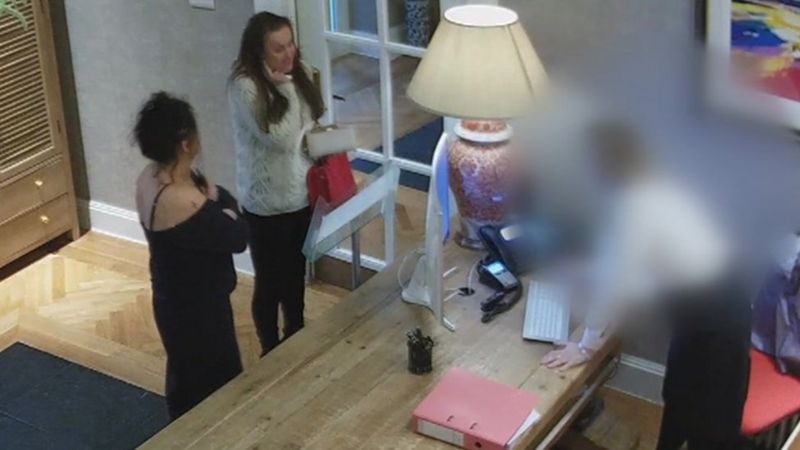
Find the location of a particular element. The width and height of the screenshot is (800, 450). keyboard is located at coordinates (549, 323).